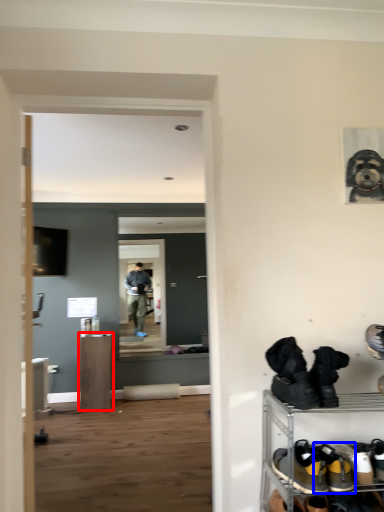
Question: Which object appears farthest to the camera in this image, furniture (highlighted by a red box) or footwear (highlighted by a blue box)?

Choices:
 (A) furniture
 (B) footwear

Answer: (A)